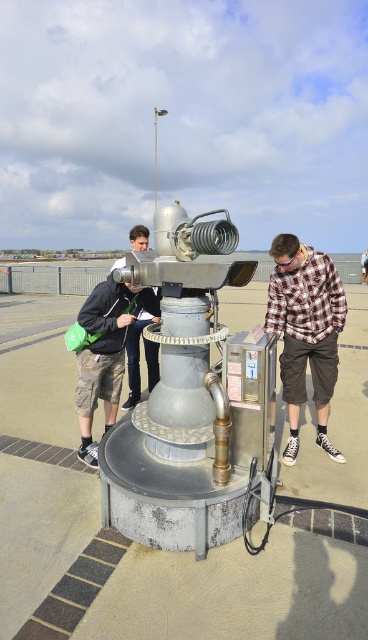
Question: Can you confirm if plaid shirt at center is bigger than matte black jacket at center?

Choices:
 (A) no
 (B) yes

Answer: (B)

Question: Which point is closer to the camera?

Choices:
 (A) (315, 260)
 (B) (90, 440)
 (C) (124, 262)

Answer: (A)

Question: Is plaid shirt at center to the left of matte black jacket at left from the viewer's perspective?

Choices:
 (A) no
 (B) yes

Answer: (A)

Question: Can you confirm if matte black jacket at center is positioned to the right of matte black jacket at left?

Choices:
 (A) yes
 (B) no

Answer: (B)

Question: Which object appears farthest from the camera in this image?

Choices:
 (A) matte black jacket at center
 (B) plaid shirt at center

Answer: (A)

Question: Which point appears closest to the camera in this image?

Choices:
 (A) (150, 365)
 (B) (287, 372)
 (C) (86, 444)

Answer: (C)